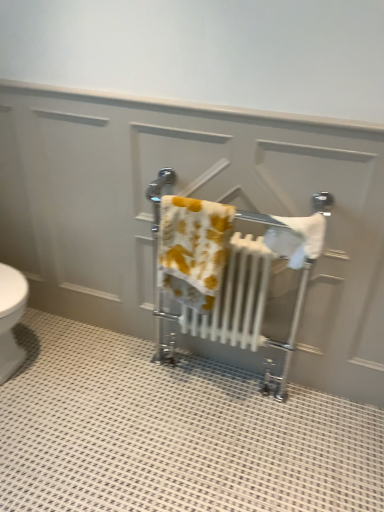
Question: Should I look upward or downward to see white cotton towel at center, the second bath towel viewed from the left?

Choices:
 (A) down
 (B) up

Answer: (B)

Question: Could you tell me if white metallic towel rack at center is facing yellow printed towel at center, marked as the 2th bath towel in a right-to-left arrangement?

Choices:
 (A) no
 (B) yes

Answer: (B)

Question: Does white metallic towel rack at center touch yellow printed towel at center, the 1th bath towel positioned from the left?

Choices:
 (A) yes
 (B) no

Answer: (B)

Question: Is white metallic towel rack at center taller than yellow printed towel at center, the 1th bath towel positioned from the left?

Choices:
 (A) yes
 (B) no

Answer: (A)

Question: Is white metallic towel rack at center bigger than yellow printed towel at center, marked as the 2th bath towel in a right-to-left arrangement?

Choices:
 (A) yes
 (B) no

Answer: (A)

Question: Considering the relative sizes of white metallic towel rack at center and yellow printed towel at center, the 1th bath towel positioned from the left, in the image provided, is white metallic towel rack at center shorter than yellow printed towel at center, the 1th bath towel positioned from the left,?

Choices:
 (A) no
 (B) yes

Answer: (A)

Question: From the image's perspective, is white metallic towel rack at center beneath yellow printed towel at center, marked as the 2th bath towel in a right-to-left arrangement?

Choices:
 (A) no
 (B) yes

Answer: (B)

Question: From the image's perspective, is yellow printed towel at center, marked as the 2th bath towel in a right-to-left arrangement, on top of white metallic towel rack at center?

Choices:
 (A) yes
 (B) no

Answer: (A)

Question: From a real-world perspective, does yellow printed towel at center, the 1th bath towel positioned from the left, stand above white metallic towel rack at center?

Choices:
 (A) no
 (B) yes

Answer: (B)

Question: Does yellow printed towel at center, the 1th bath towel positioned from the left, have a lesser width compared to white metallic towel rack at center?

Choices:
 (A) yes
 (B) no

Answer: (A)

Question: Considering the relative sizes of yellow printed towel at center, marked as the 2th bath towel in a right-to-left arrangement, and white metallic towel rack at center in the image provided, is yellow printed towel at center, marked as the 2th bath towel in a right-to-left arrangement, shorter than white metallic towel rack at center?

Choices:
 (A) no
 (B) yes

Answer: (B)

Question: Are yellow printed towel at center, the 1th bath towel positioned from the left, and white metallic towel rack at center far apart?

Choices:
 (A) yes
 (B) no

Answer: (B)

Question: Can you confirm if yellow printed towel at center, marked as the 2th bath towel in a right-to-left arrangement, is bigger than white metallic towel rack at center?

Choices:
 (A) yes
 (B) no

Answer: (B)

Question: Is white cotton towel at center, which is counted as the 1th bath towel, starting from the right, turned away from yellow printed towel at center, marked as the 2th bath towel in a right-to-left arrangement?

Choices:
 (A) yes
 (B) no

Answer: (B)